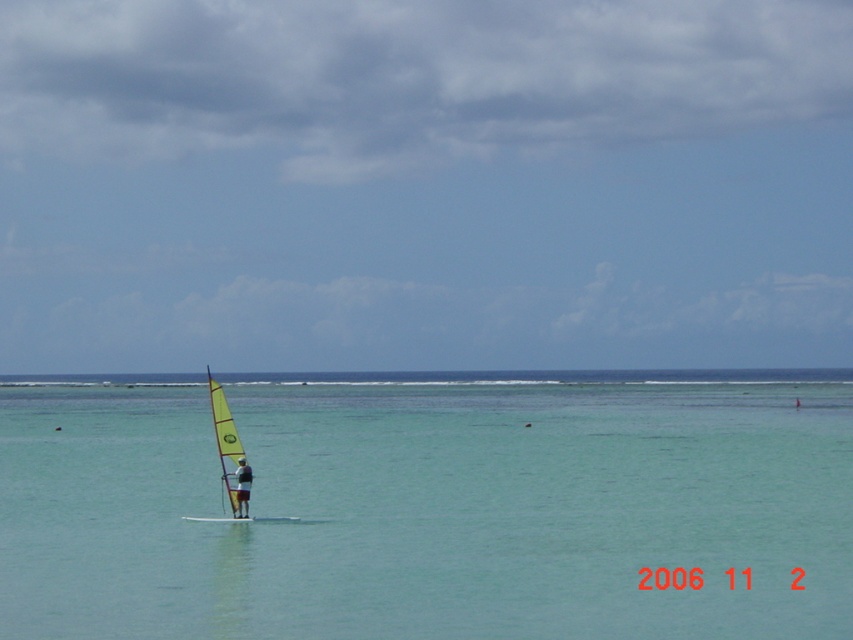
You are an observer standing on the shore looking out at the seascape. You notice the yellow matte sailboat at center and the dark gray fabric windsurfer at center. Which object appears wider from your perspective?

The yellow matte sailboat at center appears wider than the dark gray fabric windsurfer at center because its width surpasses the latter.

You are a photographer planning to capture a wide shot of the clear blue water at center and the yellow matte sailboat at center. Based on the scene, which object occupies a larger portion of the frame?

The clear blue water at center is wider than the yellow matte sailboat at center, so it occupies a larger portion of the frame.

What are the coordinates of the yellow matte sailboat at center?

The yellow matte sailboat at center is located at coordinates point (231, 460).